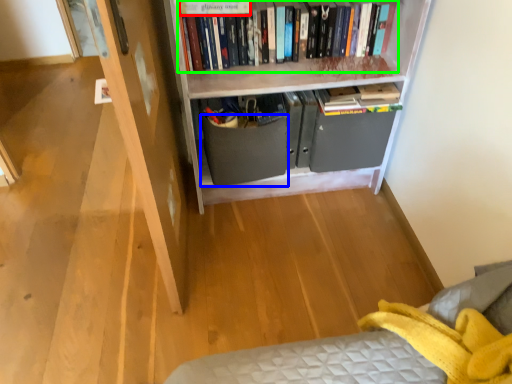
Question: Estimate the real-world distances between objects in this image. Which object is closer to paperback book (highlighted by a red box), drawer (highlighted by a blue box) or book (highlighted by a green box)?

Choices:
 (A) drawer
 (B) book

Answer: (B)